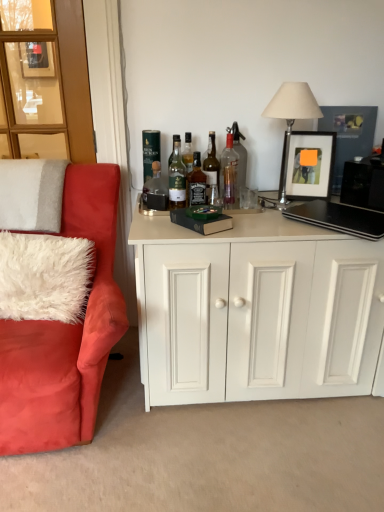
Question: Is translucent glass bottle at center, the fourth bottle viewed from the right, to the left of metallic silver table lamp at upper right from the viewer's perspective?

Choices:
 (A) no
 (B) yes

Answer: (B)

Question: From a real-world perspective, is translucent glass bottle at center, acting as the fourth bottle starting from the left, positioned under metallic silver table lamp at upper right based on gravity?

Choices:
 (A) no
 (B) yes

Answer: (B)

Question: Are translucent glass bottle at center, acting as the fourth bottle starting from the left, and metallic silver table lamp at upper right located far from each other?

Choices:
 (A) no
 (B) yes

Answer: (A)

Question: Can you confirm if translucent glass bottle at center, acting as the fourth bottle starting from the left, is smaller than metallic silver table lamp at upper right?

Choices:
 (A) yes
 (B) no

Answer: (A)

Question: Considering the relative sizes of translucent glass bottle at center, acting as the fourth bottle starting from the left, and metallic silver table lamp at upper right in the image provided, is translucent glass bottle at center, acting as the fourth bottle starting from the left, taller than metallic silver table lamp at upper right?

Choices:
 (A) yes
 (B) no

Answer: (B)

Question: From a real-world perspective, is translucent glass bottle at center, the fourth bottle viewed from the right, above or below clear glass bottle at center, placed as the 1th bottle when sorted from right to left?

Choices:
 (A) above
 (B) below

Answer: (B)

Question: Looking at their shapes, would you say translucent glass bottle at center, the fourth bottle viewed from the right, is wider or thinner than clear glass bottle at center, which is counted as the 7th bottle, starting from the left?

Choices:
 (A) wide
 (B) thin

Answer: (B)

Question: Relative to clear glass bottle at center, which is counted as the 7th bottle, starting from the left, is translucent glass bottle at center, acting as the fourth bottle starting from the left, in front or behind?

Choices:
 (A) front
 (B) behind

Answer: (A)

Question: From the image's perspective, is translucent glass bottle at center, the fourth bottle viewed from the right, located above or below clear glass bottle at center, placed as the 1th bottle when sorted from right to left?

Choices:
 (A) above
 (B) below

Answer: (B)

Question: Based on their positions, is white fluffy pillow at left, positioned as the 2th pillow in top-to-bottom order, located to the left or right of green glass bottle at center, which appears as the 5th bottle when viewed from the right?

Choices:
 (A) left
 (B) right

Answer: (A)

Question: In the image, is white fluffy pillow at left, positioned as the 2th pillow in top-to-bottom order, positioned in front of or behind green glass bottle at center, which appears as the 5th bottle when viewed from the right?

Choices:
 (A) front
 (B) behind

Answer: (A)

Question: In terms of height, does white fluffy pillow at left, positioned as the 2th pillow in top-to-bottom order, look taller or shorter compared to green glass bottle at center, the 3th bottle positioned from the left?

Choices:
 (A) short
 (B) tall

Answer: (B)

Question: From the image's perspective, is white fluffy pillow at left, positioned as the 2th pillow in top-to-bottom order, located above or below green glass bottle at center, which appears as the 5th bottle when viewed from the right?

Choices:
 (A) above
 (B) below

Answer: (B)

Question: Does point (233, 181) appear closer or farther from the camera than point (208, 180)?

Choices:
 (A) farther
 (B) closer

Answer: (B)

Question: Is clear glass bottle at center, the second bottle positioned from the right, bigger or smaller than translucent glass bottle at center, the third bottle in the right-to-left sequence?

Choices:
 (A) small
 (B) big

Answer: (B)